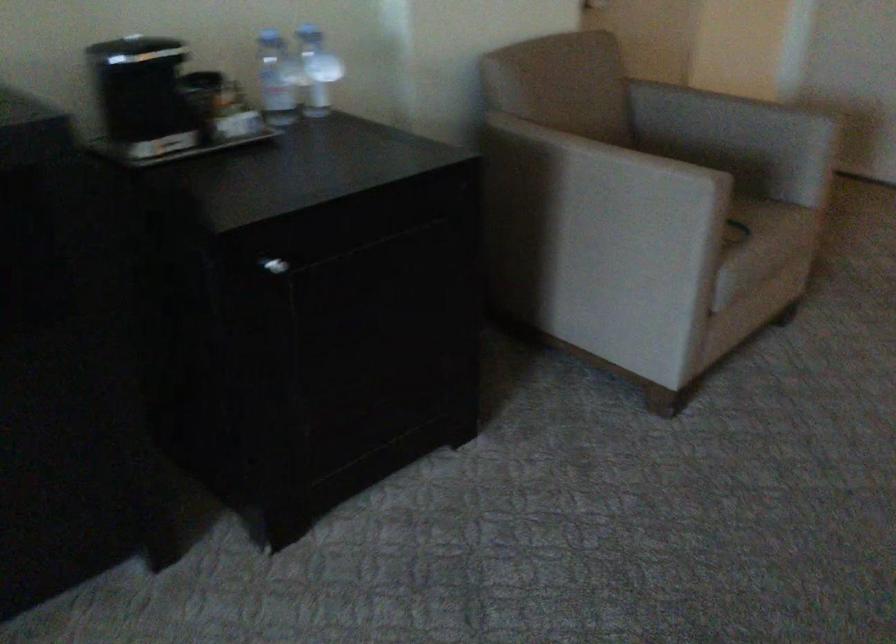
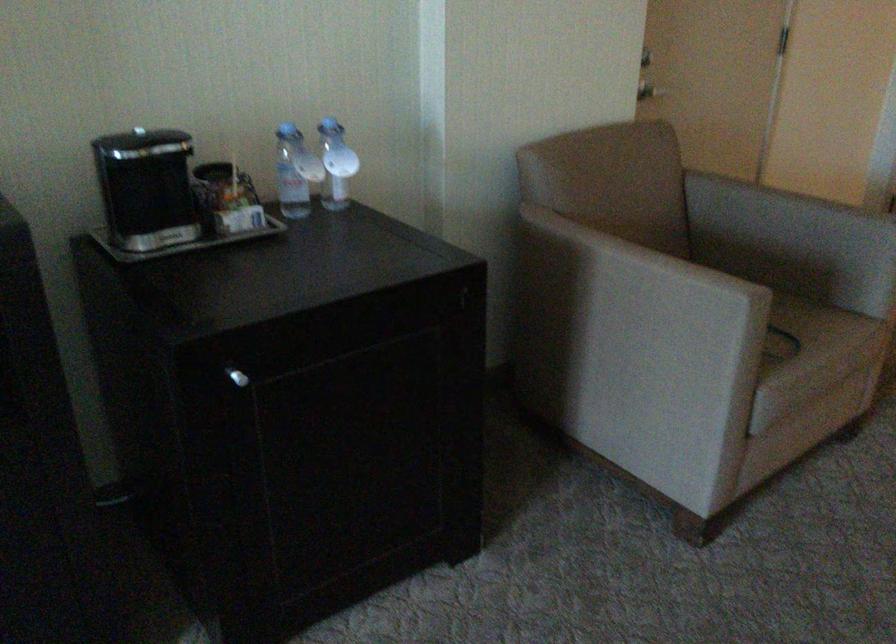
Locate, in the second image, the point that corresponds to (287,80) in the first image.

(295, 172)